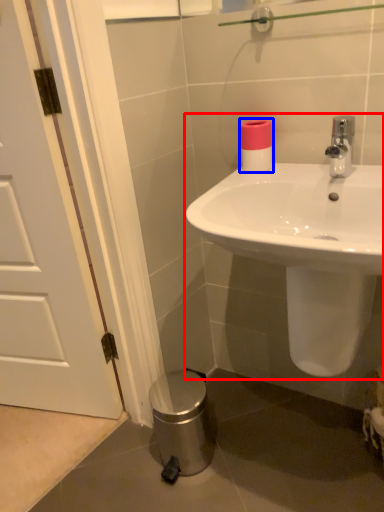
Question: Which point is closer to the camera, sink (highlighted by a red box) or toilet paper (highlighted by a blue box)?

Choices:
 (A) sink
 (B) toilet paper

Answer: (A)